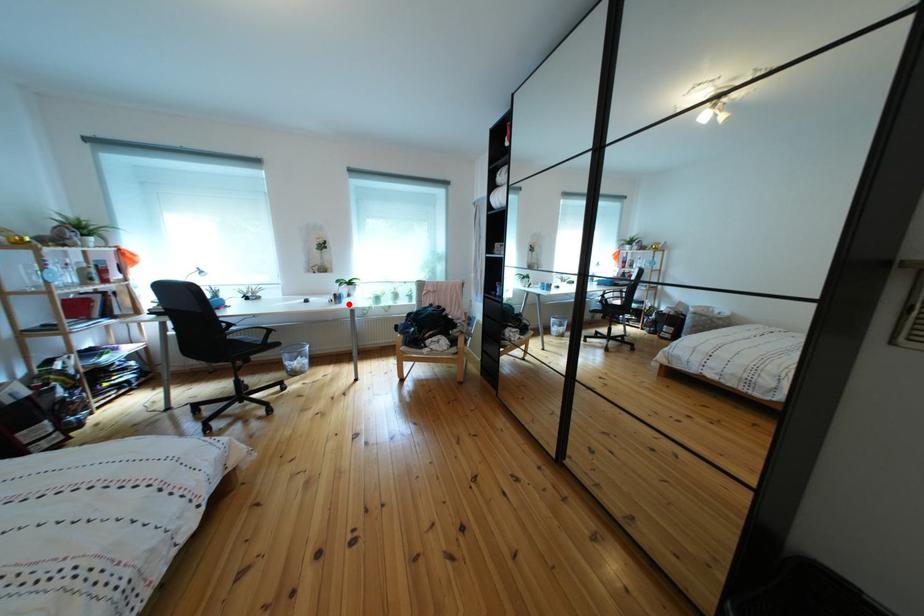
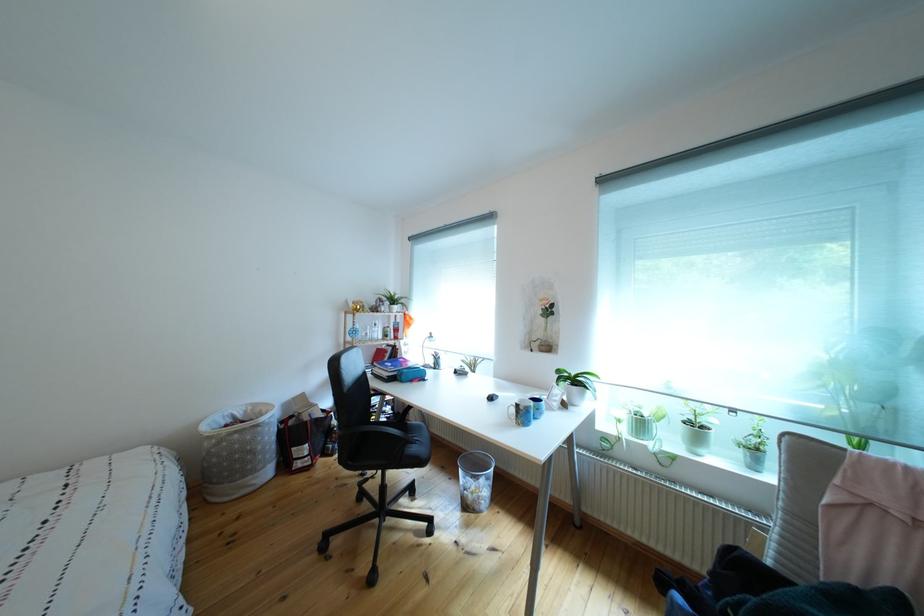
Question: I am providing you with two images of the same scene from different viewpoints. Image1 has a red point marked. In image2, the corresponding 3D location appears at what relative position? Reply with the corresponding letter.

Choices:
 (A) Closer
 (B) Farther

Answer: (B)